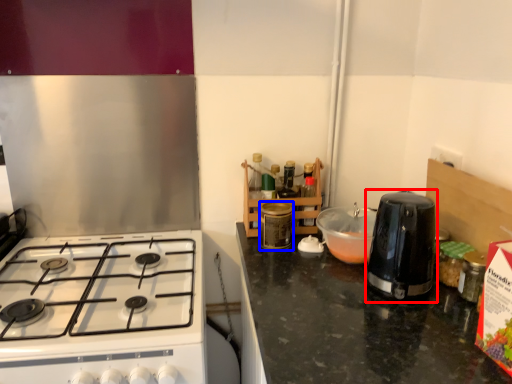
Question: Which point is further to the camera, kitchen appliance (highlighted by a red box) or kitchen appliance (highlighted by a blue box)?

Choices:
 (A) kitchen appliance
 (B) kitchen appliance

Answer: (B)